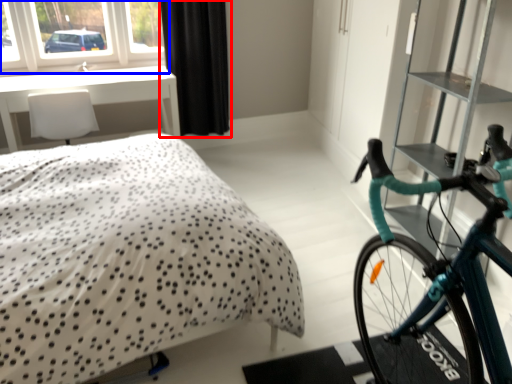
Question: Which point is further to the camera, curtain (highlighted by a red box) or window (highlighted by a blue box)?

Choices:
 (A) curtain
 (B) window

Answer: (A)